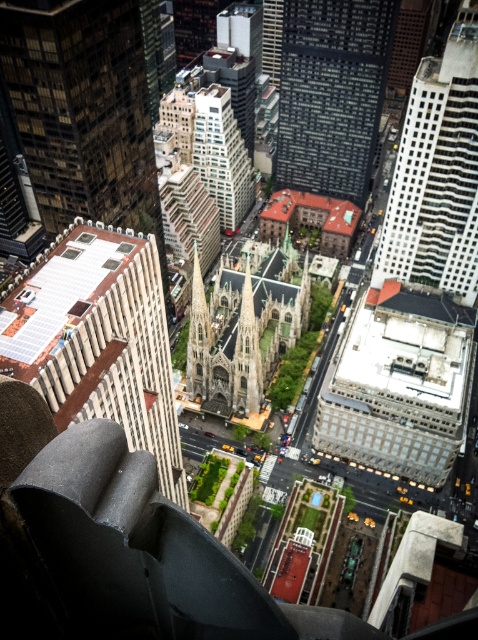
This screenshot has height=640, width=478. Describe the element at coordinates (83, 112) in the screenshot. I see `white textured roof at left` at that location.

Between white textured roof at left and glassy reflective skyscraper at upper right, which one has less height?

glassy reflective skyscraper at upper right is shorter.

The image size is (478, 640). I want to click on white textured roof at left, so click(83, 112).

Is stone gothic cathedral at center to the left of white textured building at center from the viewer's perspective?

Incorrect, stone gothic cathedral at center is not on the left side of white textured building at center.

Does stone gothic cathedral at center have a larger size compared to white textured building at center?

Yes.

Is point (189, 340) farther from camera compared to point (238, 147)?

That is False.

Find the location of `stone gothic cathedral at center`. stone gothic cathedral at center is located at coordinates (243, 330).

The image size is (478, 640). Describe the element at coordinates (83, 112) in the screenshot. I see `white textured roof at left` at that location.

Is white textured roof at left bigger than stone gothic cathedral at center?

Indeed, white textured roof at left has a larger size compared to stone gothic cathedral at center.

The width and height of the screenshot is (478, 640). In order to click on white textured roof at left in this screenshot , I will do `click(83, 112)`.